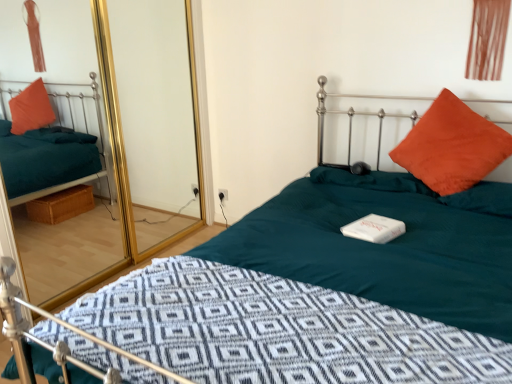
Question: From the image's perspective, is transparent glass door at upper left located above or below brown fabric curtain at upper right?

Choices:
 (A) above
 (B) below

Answer: (B)

Question: In the image, is transparent glass door at upper left positioned in front of or behind brown fabric curtain at upper right?

Choices:
 (A) front
 (B) behind

Answer: (A)

Question: Which object is the farthest from the orange suede pillow at upper right?

Choices:
 (A) transparent glass door at upper left
 (B) brown fabric curtain at upper right

Answer: (A)

Question: Considering the real-world distances, which object is farthest from the orange suede pillow at upper right?

Choices:
 (A) brown fabric curtain at upper right
 (B) transparent glass door at upper left

Answer: (B)